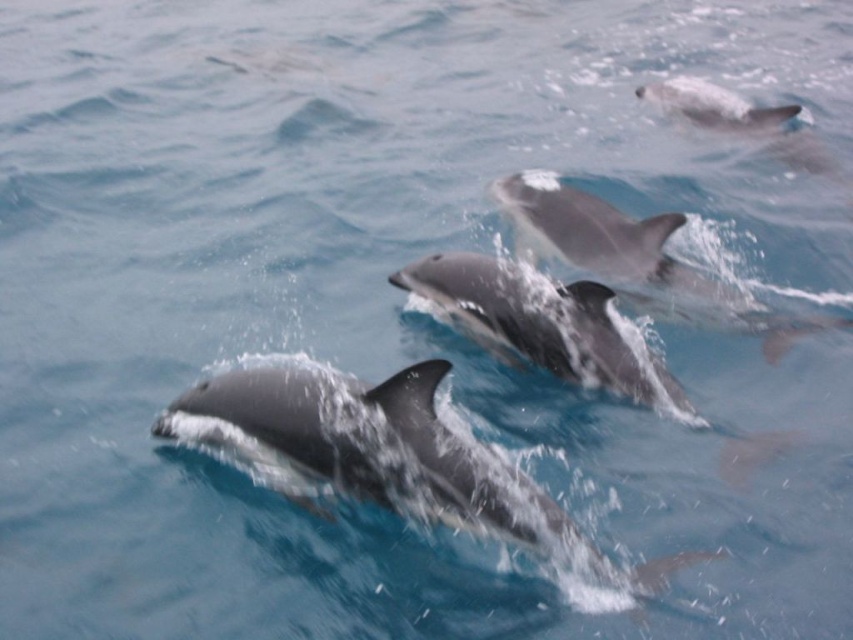
You are a marine biologist observing dolphins in the ocean. You notice two dolphins, the smooth gray dolphin at center and the smooth gray dolphin at upper right. How far apart are these two dolphins from each other?

The smooth gray dolphin at center and the smooth gray dolphin at upper right are 3.50 meters apart from each other.

You are a marine biologist observing the dolphins in the ocean. You notice two dolphins, the glossy gray dolphin at center and the smooth gray dolphin at upper right. Which dolphin do you think is larger?

The glossy gray dolphin at center is bigger than the smooth gray dolphin at upper right.

You are a marine biologist observing dolphins in the ocean. You notice two dolphins, the smooth gray dolphin at center and the smooth gray dolphin at upper right. From your vantage point, which dolphin is positioned more to the left?

The smooth gray dolphin at center is positioned more to the left than the smooth gray dolphin at upper right.